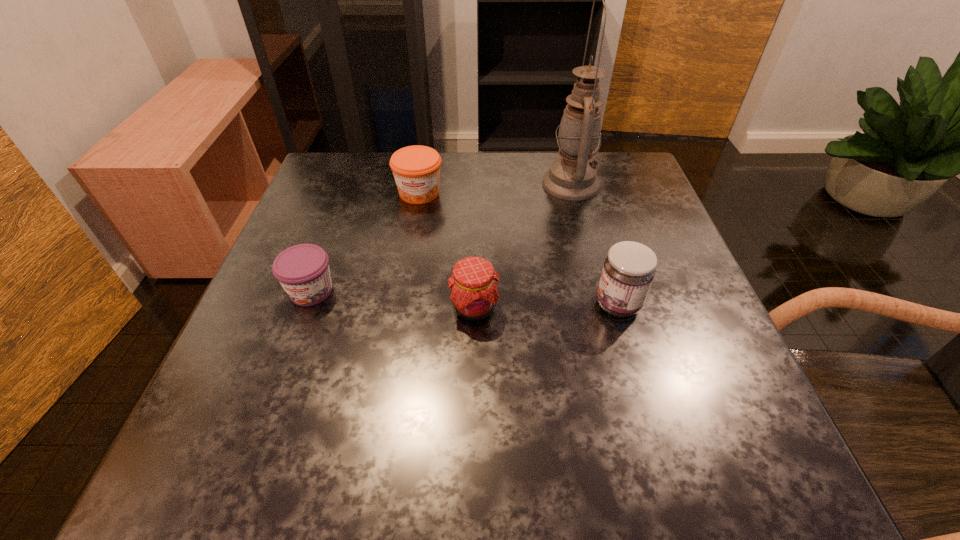
The height and width of the screenshot is (540, 960). Find the location of `object that is at the far right corner`. object that is at the far right corner is located at coordinates (572, 177).

The height and width of the screenshot is (540, 960). Find the location of `vacant space at the far edge of the desktop`. vacant space at the far edge of the desktop is located at coordinates (487, 180).

Locate an element on the screen. vacant position at the near edge of the desktop is located at coordinates (326, 472).

In order to click on vacant space at the left edge of the desktop in this screenshot , I will do `click(324, 215)`.

This screenshot has width=960, height=540. In the image, there is a desktop. What are the coordinates of `vacant space at the right edge` in the screenshot? It's located at (607, 246).

The height and width of the screenshot is (540, 960). I want to click on vacant point at the far left corner, so click(x=363, y=187).

Image resolution: width=960 pixels, height=540 pixels. I want to click on free space at the far right corner of the desktop, so click(x=635, y=161).

Where is `blank space at the near right corner of the desktop`? Image resolution: width=960 pixels, height=540 pixels. blank space at the near right corner of the desktop is located at coordinates (700, 469).

Locate an element on the screen. The width and height of the screenshot is (960, 540). vacant area that lies between the third object from right to left and the tallest jam is located at coordinates (546, 306).

The image size is (960, 540). I want to click on unoccupied position between the third object from left to right and the tallest jam, so click(546, 306).